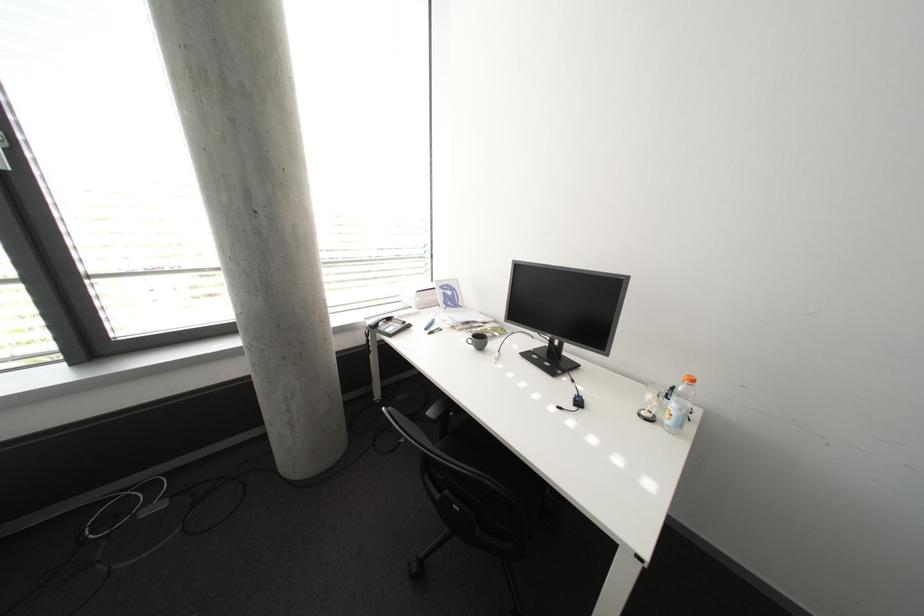
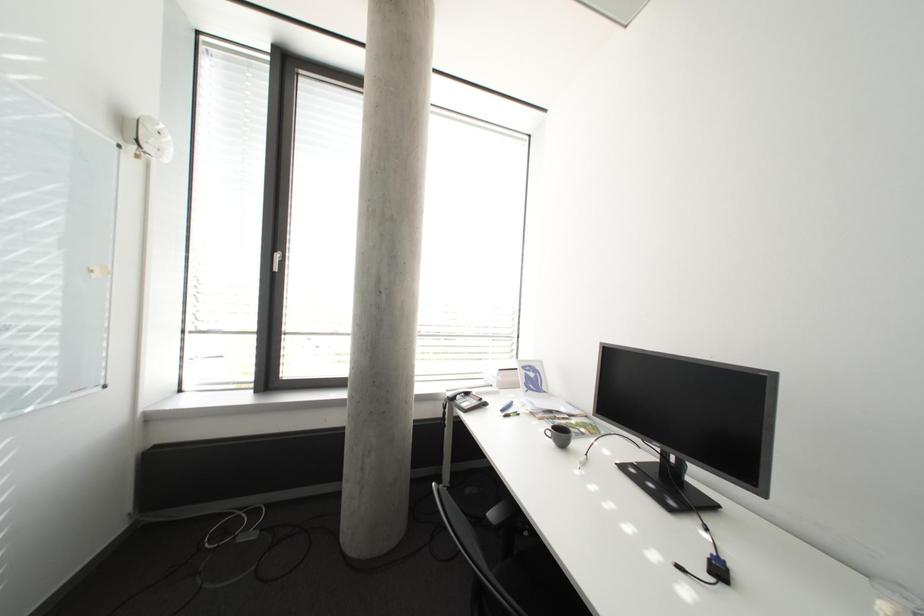
Question: In a continuous first-person perspective shot, in which direction is the camera moving?

Choices:
 (A) Left
 (B) Right
 (C) Forward
 (D) Backward

Answer: (B)